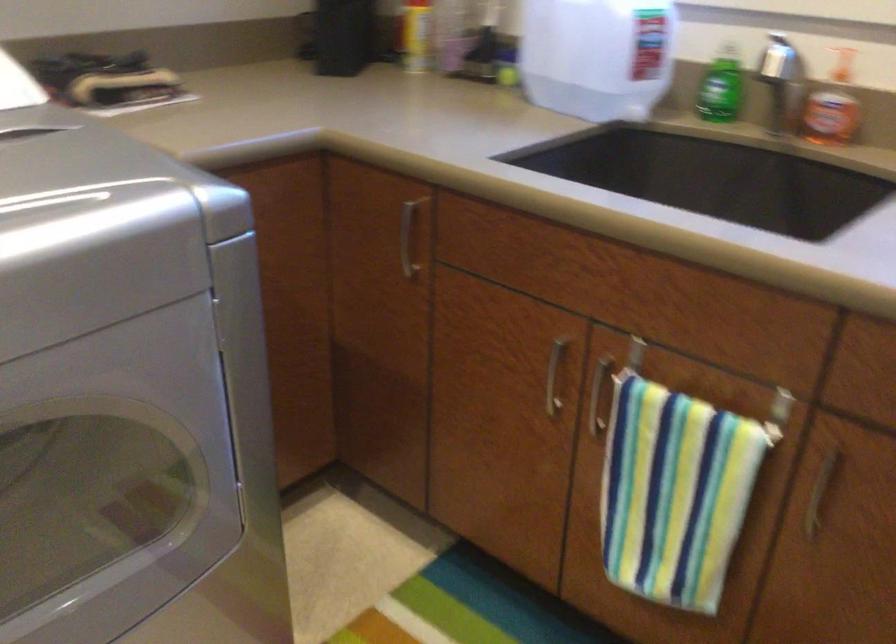
Identify the location of silver faucet handle. (788, 96).